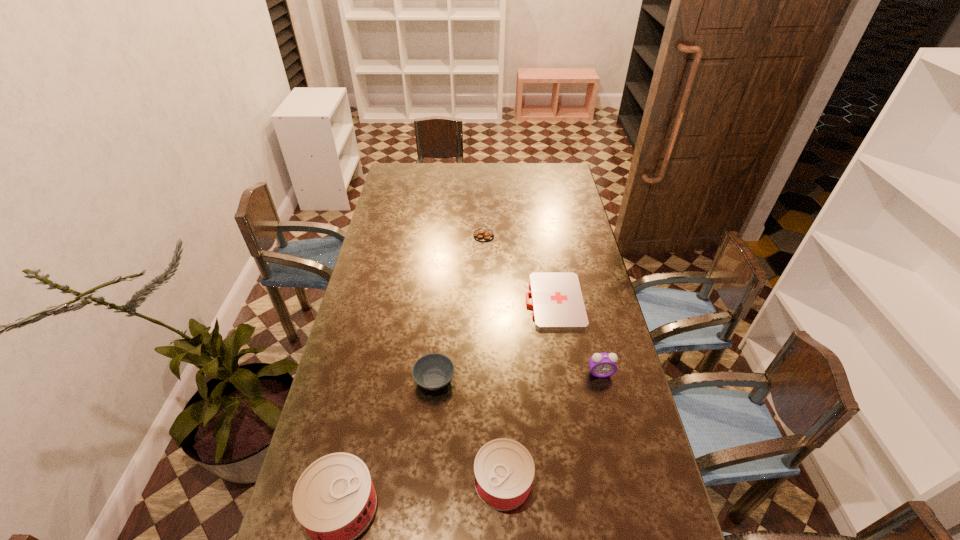
Find the location of a particular element. The width and height of the screenshot is (960, 540). the right can is located at coordinates (504, 469).

Where is `alarm clock`? alarm clock is located at coordinates (602, 365).

Image resolution: width=960 pixels, height=540 pixels. In order to click on the farthest object in this screenshot , I will do `click(483, 234)`.

At what (x,y) coordinates should I click in order to perform the action: click on the second shortest object. Please return your answer as a coordinate pair (x, y). This screenshot has width=960, height=540. Looking at the image, I should click on (483, 234).

You are a GUI agent. You are given a task and a screenshot of the screen. Output one action in this format:
    pyautogui.click(x=<x>, y=<y>)
    Task: Click on the fourth tallest object
    Image resolution: width=960 pixels, height=540 pixels.
    Given the screenshot: What is the action you would take?
    pyautogui.click(x=433, y=371)

Where is `soup bowl`? soup bowl is located at coordinates (433, 371).

You are a GUI agent. You are given a task and a screenshot of the screen. Output one action in this format:
    pyautogui.click(x=<x>, y=<y>)
    Task: Click on the fifth nearest object
    This screenshot has height=540, width=960.
    Given the screenshot: What is the action you would take?
    pyautogui.click(x=557, y=301)

Where is `the shortest object`? The width and height of the screenshot is (960, 540). the shortest object is located at coordinates (557, 301).

Find the location of a particular element. This screenshot has width=960, height=540. free space located on the right of the shorter can is located at coordinates (652, 481).

The height and width of the screenshot is (540, 960). Identify the location of free space located on the face of the alarm clock. (606, 395).